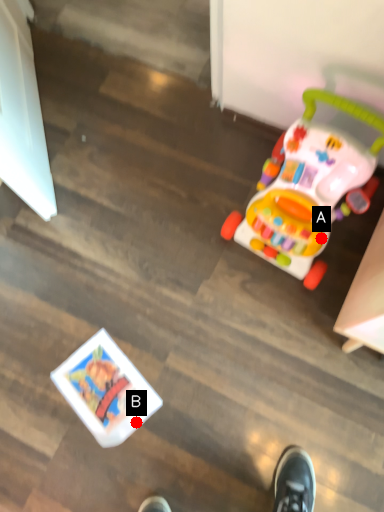
Question: Two points are circled on the image, labeled by A and B beside each circle. Which point is farther from the camera taking this photo?

Choices:
 (A) A is further
 (B) B is further

Answer: (B)